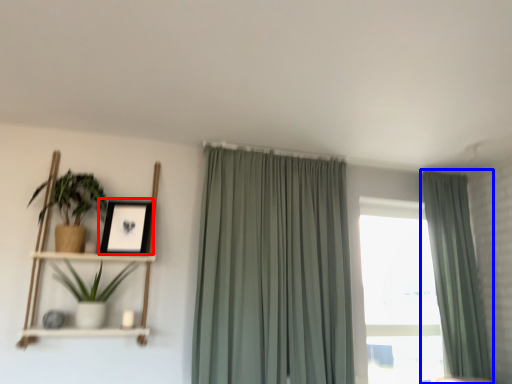
Question: Which object appears farthest to the camera in this image, picture frame (highlighted by a red box) or curtain (highlighted by a blue box)?

Choices:
 (A) picture frame
 (B) curtain

Answer: (B)